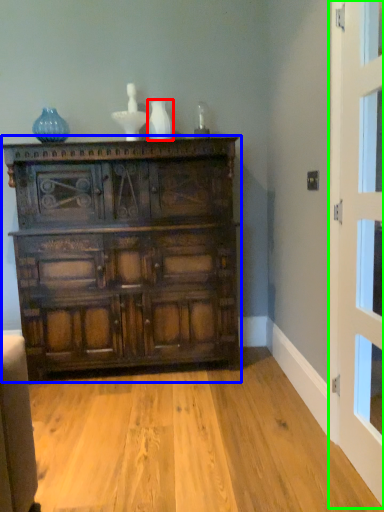
Question: Estimate the real-world distances between objects in this image. Which object is closer to vase (highlighted by a red box), chest of drawers (highlighted by a blue box) or door (highlighted by a green box)?

Choices:
 (A) chest of drawers
 (B) door

Answer: (A)